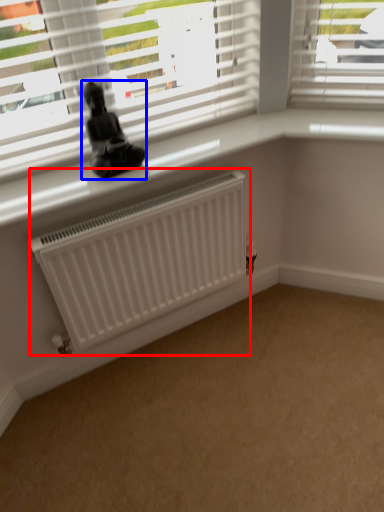
Question: Which object is closer to the camera taking this photo, radiator (highlighted by a red box) or miniature (highlighted by a blue box)?

Choices:
 (A) radiator
 (B) miniature

Answer: (B)